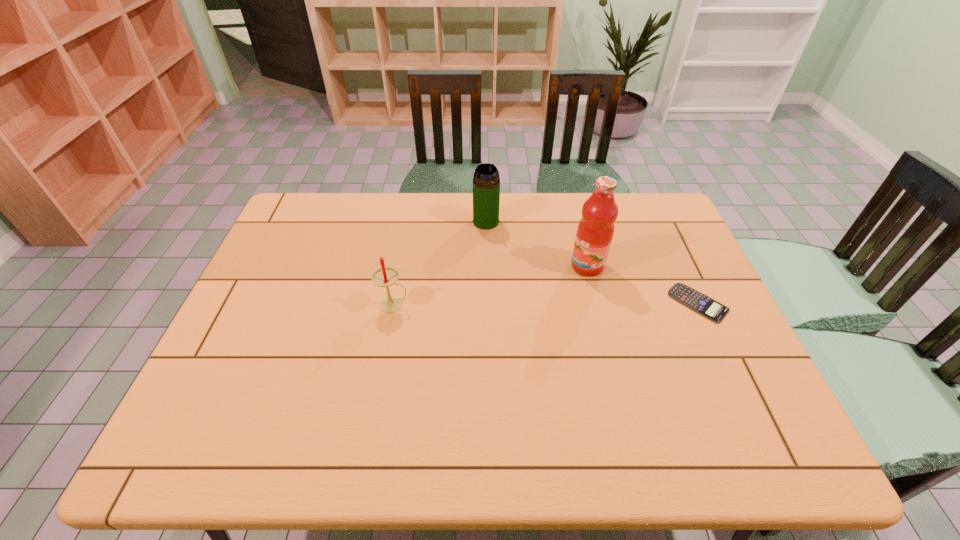
This screenshot has height=540, width=960. I want to click on free spot on the desktop that is between the candle and the shortest object and is positioned on the front label of the third nearest object, so click(x=536, y=304).

At what (x,y) coordinates should I click in order to perform the action: click on free space on the desktop that is between the candle and the calculator and is positioned from the spout of the farthest object. Please return your answer as a coordinate pair (x, y). Looking at the image, I should click on (569, 303).